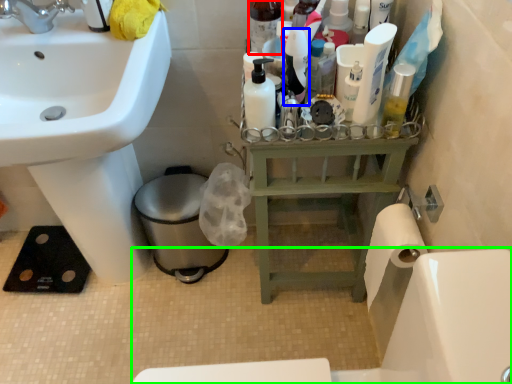
Question: Considering the real-world distances, which object is farthest from toiletry (highlighted by a red box)? toiletry (highlighted by a blue box) or bath (highlighted by a green box)?

Choices:
 (A) toiletry
 (B) bath

Answer: (B)